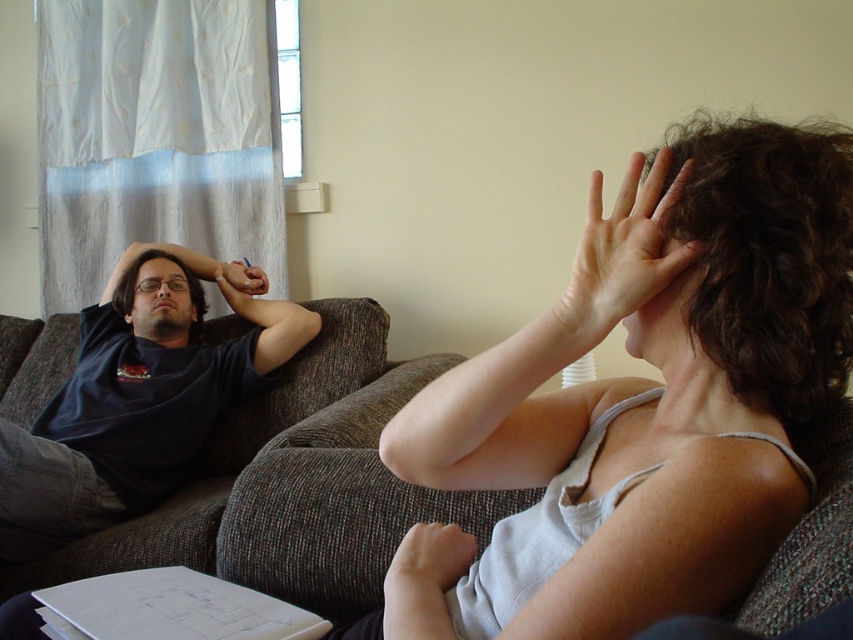
Who is taller, dark blue t-shirt at left or matte skin hand at upper right?

dark blue t-shirt at left is taller.

Which is in front, point (16, 531) or point (614, 244)?

Point (614, 244) is more forward.

Does point (177, 467) lie in front of point (624, 244)?

That is False.

Identify the location of dark blue t-shirt at left. The height and width of the screenshot is (640, 853). (137, 396).

Does dark blue t-shirt at left appear on the right side of matte black head at left?

Yes, dark blue t-shirt at left is to the right of matte black head at left.

Between dark blue t-shirt at left and matte black head at left, which one has more height?

Standing taller between the two is dark blue t-shirt at left.

Is point (7, 438) closer to viewer compared to point (201, 292)?

Yes.

Identify the location of dark blue t-shirt at left. This screenshot has height=640, width=853. (137, 396).

Which is more to the right, matte skin hand at upper right or matte black head at left?

matte skin hand at upper right

From the picture: Can you confirm if matte skin hand at upper right is taller than matte black head at left?

No, matte skin hand at upper right is not taller than matte black head at left.

At what (x,y) coordinates should I click in order to perform the action: click on matte skin hand at upper right. Please return your answer as a coordinate pair (x, y). Looking at the image, I should click on (622, 253).